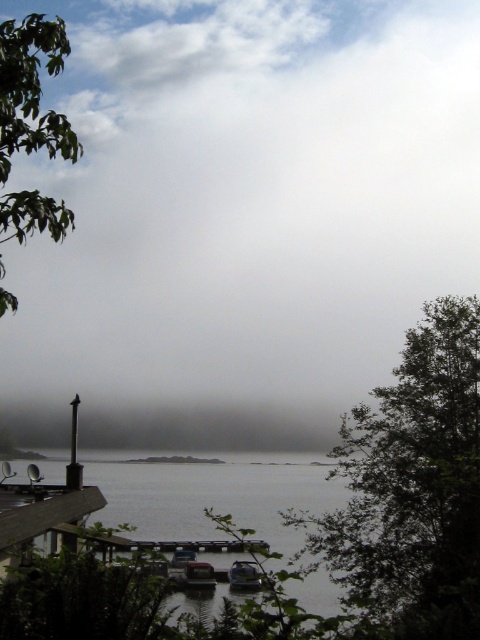
You are standing on the dock and see the gray matte water at center and the white plastic boat at lower center. Which object is closer to your right side?

The gray matte water at center is to the right of the white plastic boat at lower center, so it is closer to your right side.

You are standing on the lakeside dock and see the green leafy tree at right and the metallic gray boat at center. Which object is positioned higher in the scene?

The green leafy tree at right is positioned above the metallic gray boat at center, so it is higher in the scene.